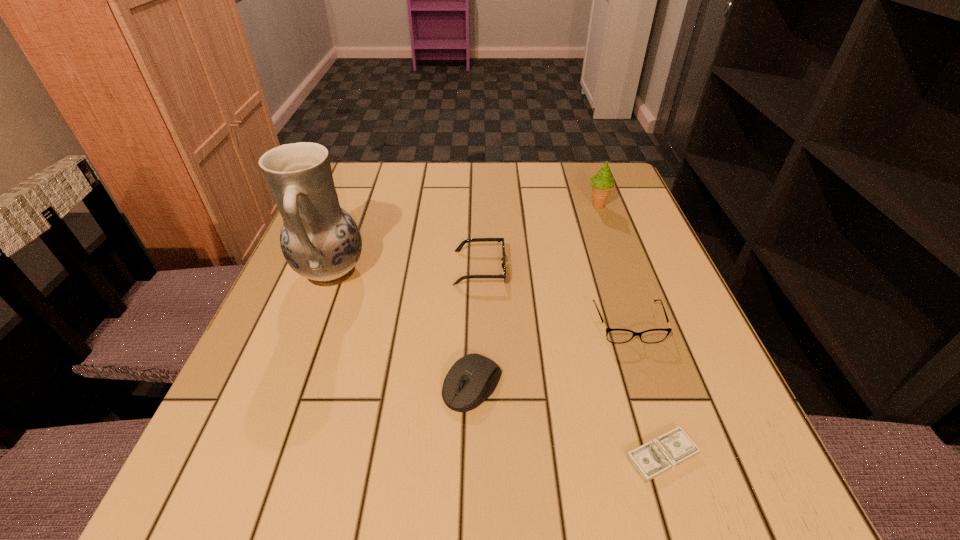
Find the location of `money positioned at the right edge`. money positioned at the right edge is located at coordinates (652, 459).

Where is `object that is at the far right corner`? The image size is (960, 540). object that is at the far right corner is located at coordinates (602, 183).

Find the location of a particular element. This screenshot has height=540, width=960. object present at the near right corner is located at coordinates pyautogui.click(x=652, y=459).

Locate an element on the screen. The height and width of the screenshot is (540, 960). vacant area at the far edge is located at coordinates (527, 178).

Find the location of a particular element. vacant space at the near edge is located at coordinates (588, 519).

In the image, there is a desktop. Where is `free region at the left edge`? This screenshot has width=960, height=540. free region at the left edge is located at coordinates (295, 307).

The height and width of the screenshot is (540, 960). What are the coordinates of `vacant region at the right edge` in the screenshot? It's located at (687, 387).

This screenshot has width=960, height=540. In order to click on free space at the far left corner of the desktop in this screenshot , I will do `click(362, 172)`.

Find the location of a particular element. This screenshot has width=960, height=540. vacant region at the near left corner of the desktop is located at coordinates (222, 496).

This screenshot has height=540, width=960. Find the location of `vacant space at the near right corner of the desktop`. vacant space at the near right corner of the desktop is located at coordinates (689, 469).